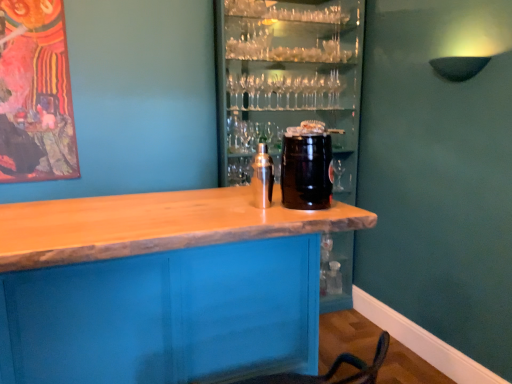
Question: Does wooden table at center have a smaller size compared to satin silver shaker at center, the first beverage in the left-to-right sequence?

Choices:
 (A) no
 (B) yes

Answer: (A)

Question: Can you confirm if wooden table at center is bigger than satin silver shaker at center, the first beverage in the left-to-right sequence?

Choices:
 (A) no
 (B) yes

Answer: (B)

Question: From a real-world perspective, does wooden table at center sit lower than satin silver shaker at center, which ranks as the 2th beverage in right-to-left order?

Choices:
 (A) no
 (B) yes

Answer: (B)

Question: Is wooden table at center taller than satin silver shaker at center, the first beverage in the left-to-right sequence?

Choices:
 (A) no
 (B) yes

Answer: (B)

Question: From the image's perspective, is wooden table at center located above satin silver shaker at center, the first beverage in the left-to-right sequence?

Choices:
 (A) yes
 (B) no

Answer: (B)

Question: Is wooden table at center thinner than satin silver shaker at center, which ranks as the 2th beverage in right-to-left order?

Choices:
 (A) no
 (B) yes

Answer: (A)

Question: From a real-world perspective, is black matte keg at center, the first beverage from the right, on wooden at center?

Choices:
 (A) yes
 (B) no

Answer: (A)

Question: Is black matte keg at center, the first beverage from the right, oriented towards wooden at center?

Choices:
 (A) yes
 (B) no

Answer: (B)

Question: Is black matte keg at center, acting as the 2th beverage starting from the left, located outside wooden at center?

Choices:
 (A) yes
 (B) no

Answer: (A)

Question: Does black matte keg at center, acting as the 2th beverage starting from the left, come behind wooden at center?

Choices:
 (A) yes
 (B) no

Answer: (B)

Question: Is black matte keg at center, acting as the 2th beverage starting from the left, turned away from wooden at center?

Choices:
 (A) yes
 (B) no

Answer: (B)

Question: Can you confirm if black matte keg at center, acting as the 2th beverage starting from the left, is wider than wooden at center?

Choices:
 (A) no
 (B) yes

Answer: (A)

Question: Is wooden at center at the left side of satin silver shaker at center, which ranks as the 2th beverage in right-to-left order?

Choices:
 (A) no
 (B) yes

Answer: (A)